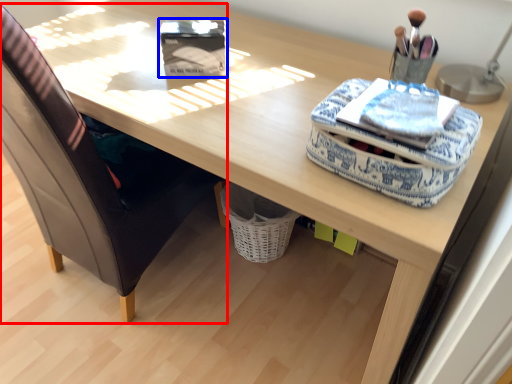
Question: Which object is further to the camera taking this photo, chair (highlighted by a red box) or storage box (highlighted by a blue box)?

Choices:
 (A) chair
 (B) storage box

Answer: (B)